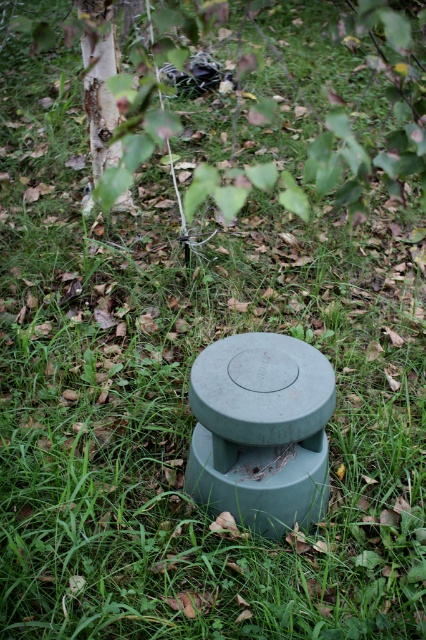
Between green matte cement at center and smooth white bark at upper left, which one appears on the right side from the viewer's perspective?

green matte cement at center is more to the right.

Is green matte cement at center in front of smooth white bark at upper left?

Yes.

The height and width of the screenshot is (640, 426). Describe the element at coordinates (261, 429) in the screenshot. I see `green matte cement at center` at that location.

Locate an element on the screen. green matte cement at center is located at coordinates (261, 429).